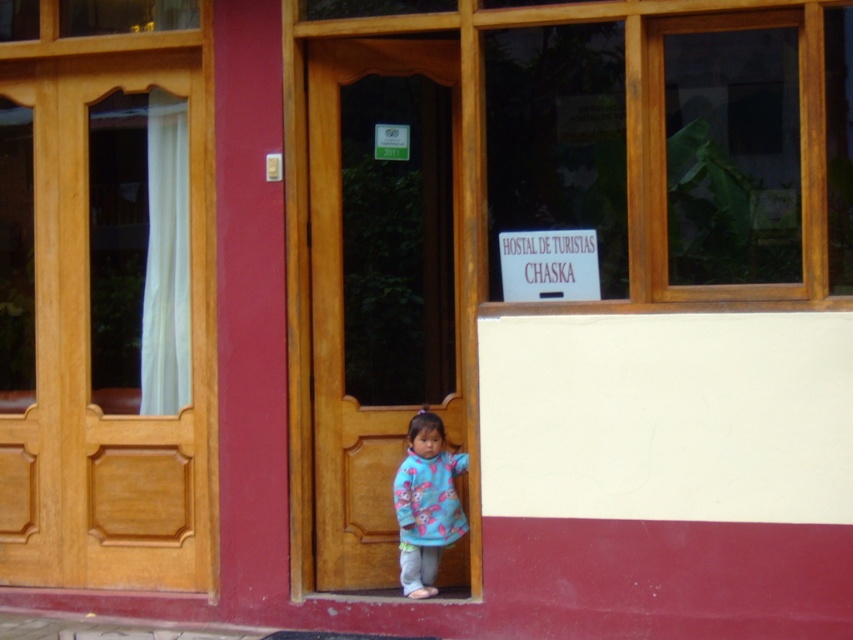
You are a painter hired to paint the entrance of the building. You have a ladder that can reach up to 2 meters. The wooden door at center needs to be painted, but you also need to paint the fluffy fleece sweater at center. Which object can you paint without needing a taller ladder?

The fluffy fleece sweater at center can be painted without needing a taller ladder because it is shorter than the wooden door at center, which requires a taller ladder to reach its full height.

You are standing at the entrance of the building and want to locate the wooden door at center. Based on the 2D coordinates provided, where would you find it?

The wooden door at center is located at the 2D coordinates point [379,284].

You are a parent trying to dress your child for a visit to the building shown. The child is standing by the wooden door at left wearing the fluffy fleece sweater at center. Based on the size comparison between the two, which item is more likely to be the correct size for the child?

The fluffy fleece sweater at center is more likely to be the correct size for the child since it is smaller than the wooden door at left.